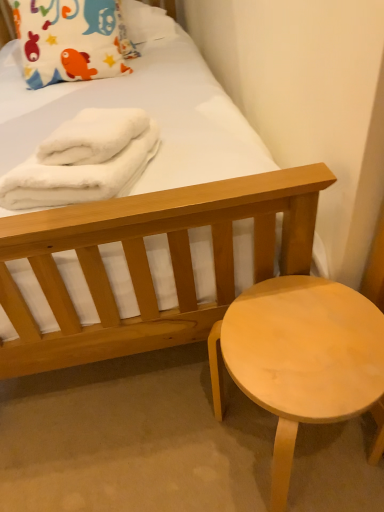
Question: Does light wood stool at lower right appear on the right side of matte cotton pillow at upper left?

Choices:
 (A) yes
 (B) no

Answer: (A)

Question: From the image's perspective, is light wood stool at lower right over matte cotton pillow at upper left?

Choices:
 (A) no
 (B) yes

Answer: (A)

Question: Can you confirm if light wood stool at lower right is bigger than matte cotton pillow at upper left?

Choices:
 (A) no
 (B) yes

Answer: (A)

Question: Would you say matte cotton pillow at upper left is part of light wood stool at lower right's contents?

Choices:
 (A) no
 (B) yes

Answer: (A)

Question: From a real-world perspective, is light wood stool at lower right on matte cotton pillow at upper left?

Choices:
 (A) yes
 (B) no

Answer: (B)

Question: Considering the positions of point (13, 202) and point (109, 65), is point (13, 202) closer or farther from the camera than point (109, 65)?

Choices:
 (A) farther
 (B) closer

Answer: (B)

Question: From the image's perspective, is white fluffy bath towel at upper left, marked as the 1th bath towel in a left-to-right arrangement, located above or below matte cotton pillow at upper left?

Choices:
 (A) below
 (B) above

Answer: (A)

Question: Relative to matte cotton pillow at upper left, is white fluffy bath towel at upper left, marked as the 1th bath towel in a left-to-right arrangement, in front or behind?

Choices:
 (A) front
 (B) behind

Answer: (A)

Question: Based on their sizes in the image, would you say white fluffy bath towel at upper left, marked as the 1th bath towel in a left-to-right arrangement, is bigger or smaller than matte cotton pillow at upper left?

Choices:
 (A) big
 (B) small

Answer: (B)

Question: Is point (59, 52) positioned closer to the camera than point (4, 180)?

Choices:
 (A) closer
 (B) farther

Answer: (B)

Question: Considering their positions, is matte cotton pillow at upper left located in front of or behind white fluffy bath towel at upper left, marked as the 2th bath towel in a right-to-left arrangement?

Choices:
 (A) front
 (B) behind

Answer: (B)

Question: From the image's perspective, relative to white fluffy bath towel at upper left, marked as the 1th bath towel in a left-to-right arrangement, is matte cotton pillow at upper left above or below?

Choices:
 (A) below
 (B) above

Answer: (B)

Question: Is matte cotton pillow at upper left situated inside white fluffy bath towel at upper left, marked as the 1th bath towel in a left-to-right arrangement, or outside?

Choices:
 (A) outside
 (B) inside

Answer: (A)

Question: From the image's perspective, is light wood stool at lower right above or below white fluffy bath towel at upper left, marked as the 2th bath towel in a right-to-left arrangement?

Choices:
 (A) above
 (B) below

Answer: (B)

Question: Relative to white fluffy bath towel at upper left, marked as the 2th bath towel in a right-to-left arrangement, is light wood stool at lower right in front or behind?

Choices:
 (A) front
 (B) behind

Answer: (A)